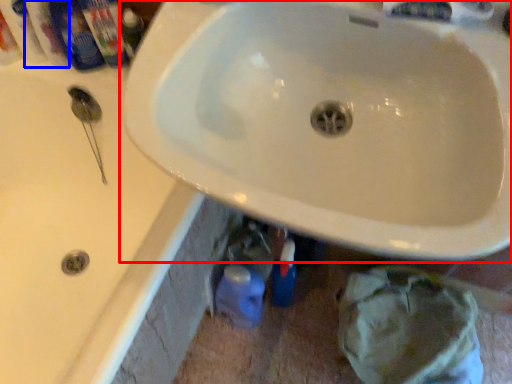
Question: Among these objects, which one is farthest to the camera, sink (highlighted by a red box) or mouthwash (highlighted by a blue box)?

Choices:
 (A) sink
 (B) mouthwash

Answer: (B)